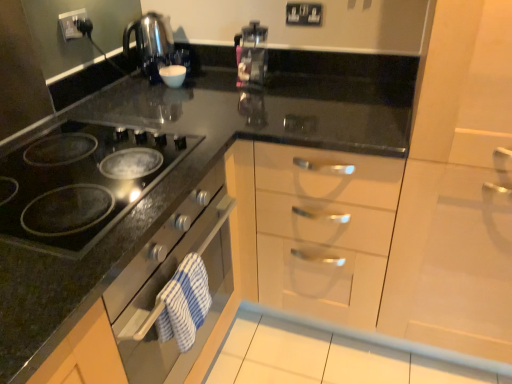
Question: From their relative heights in the image, would you say black glass cooktop at left is taller or shorter than white glossy cabinet at right?

Choices:
 (A) short
 (B) tall

Answer: (A)

Question: Is black glass cooktop at left in front of or behind white glossy cabinet at right in the image?

Choices:
 (A) behind
 (B) front

Answer: (A)

Question: Which object is positioned closest to the black plastic electric outlet at upper center, positioned as the 1th electric outlet in back-to-front order?

Choices:
 (A) black glass cooktop at left
 (B) black plastic electric outlet at upper left, placed as the second electric outlet when sorted from back to front
 (C) transparent plastic coffee machine at center
 (D) white glossy cabinet at right
 (E) white glossy drawer at center

Answer: (C)

Question: Considering the real-world distances, which object is closest to the black glass cooktop at left?

Choices:
 (A) transparent plastic coffee machine at center
 (B) black plastic electric outlet at upper left, acting as the 2th electric outlet starting from the right
 (C) black plastic electric outlet at upper center, the 2th electric outlet positioned from the left
 (D) white glossy cabinet at right
 (E) white glossy drawer at center

Answer: (E)